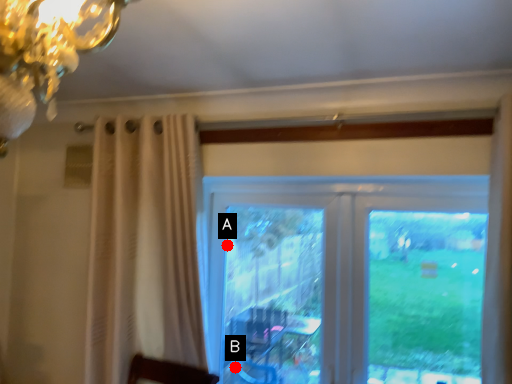
Question: Two points are circled on the image, labeled by A and B beside each circle. Which point is farther to the camera?

Choices:
 (A) A is further
 (B) B is further

Answer: (B)